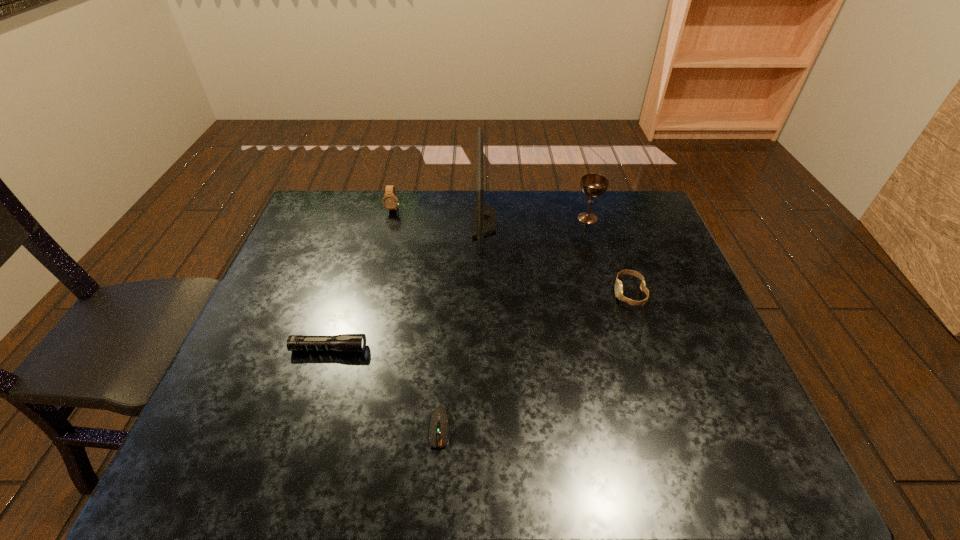
You are a GUI agent. You are given a task and a screenshot of the screen. Output one action in this format:
    pyautogui.click(x=<x>, y=<y>)
    Task: Click on the vacant space at the far left corner
    The height and width of the screenshot is (540, 960).
    Given the screenshot: What is the action you would take?
    pyautogui.click(x=316, y=195)

Where is `free space at the far right corner of the desktop`? The width and height of the screenshot is (960, 540). free space at the far right corner of the desktop is located at coordinates (635, 224).

The height and width of the screenshot is (540, 960). I want to click on free spot between the fourth object from right to left and the fifth shortest object, so (x=514, y=323).

You are a GUI agent. You are given a task and a screenshot of the screen. Output one action in this format:
    pyautogui.click(x=<x>, y=<y>)
    Task: Click on the empty location between the second tallest object and the right watch
    
    Given the screenshot: What is the action you would take?
    pyautogui.click(x=609, y=255)

This screenshot has height=540, width=960. Identify the location of free area in between the fourth farthest object and the fourth shortest object. (512, 251).

Find the location of a particular element. free spot between the fifth farthest object and the left watch is located at coordinates (361, 279).

The image size is (960, 540). I want to click on free space between the shortest object and the tallest object, so click(462, 325).

The height and width of the screenshot is (540, 960). I want to click on free spot between the chalice and the fourth farthest object, so click(609, 255).

Identify the location of free space between the farther watch and the shortest object. pos(417,318).

You are a GUI agent. You are given a task and a screenshot of the screen. Output one action in this format:
    pyautogui.click(x=<x>, y=<y>)
    Task: Click on the free space between the chalice and the tallest object
    This screenshot has width=960, height=540.
    Given the screenshot: What is the action you would take?
    pyautogui.click(x=536, y=219)